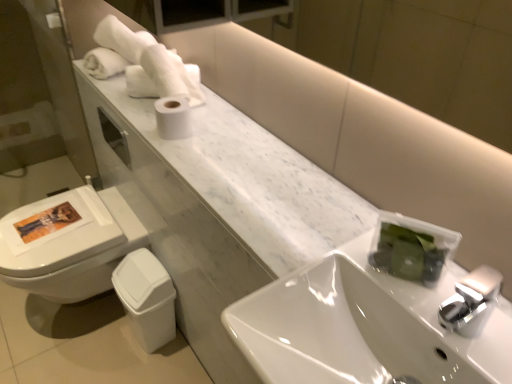
You are a GUI agent. You are given a task and a screenshot of the screen. Output one action in this format:
    pyautogui.click(x=<x>, y=<y>)
    Task: Click on the blank space to the left of white matte toilet paper at center
    This screenshot has width=512, height=384.
    Given the screenshot: What is the action you would take?
    pyautogui.click(x=132, y=118)